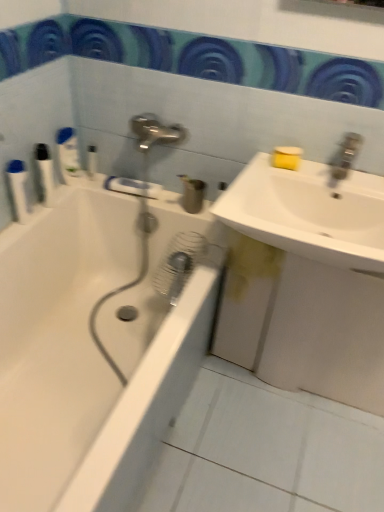
In order to click on vacant space to the left of satin nickel faucet at upper right in this screenshot , I will do `click(288, 168)`.